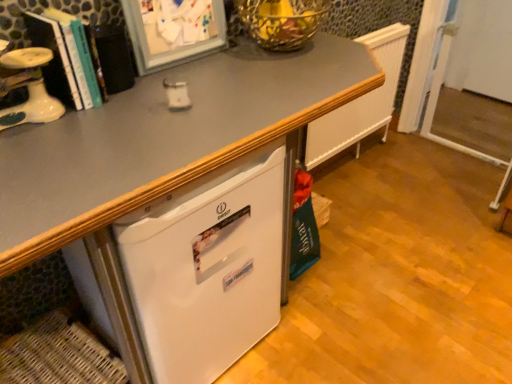
Question: From the image's perspective, is white glossy desk at center under hardcover book at left?

Choices:
 (A) yes
 (B) no

Answer: (A)

Question: Is white glossy desk at center smaller than hardcover book at left?

Choices:
 (A) yes
 (B) no

Answer: (B)

Question: From a real-world perspective, is white glossy desk at center located beneath hardcover book at left?

Choices:
 (A) no
 (B) yes

Answer: (B)

Question: Considering the relative sizes of white glossy desk at center and hardcover book at left in the image provided, is white glossy desk at center taller than hardcover book at left?

Choices:
 (A) no
 (B) yes

Answer: (B)

Question: Is white glossy desk at center further to the viewer compared to hardcover book at left?

Choices:
 (A) yes
 (B) no

Answer: (B)

Question: Does white glossy desk at center come in front of hardcover book at left?

Choices:
 (A) no
 (B) yes

Answer: (B)

Question: From a real-world perspective, is hardcover book at left on woven brown basket at lower left?

Choices:
 (A) no
 (B) yes

Answer: (B)

Question: Does hardcover book at left have a greater height compared to woven brown basket at lower left?

Choices:
 (A) yes
 (B) no

Answer: (A)

Question: Is hardcover book at left further to the viewer compared to woven brown basket at lower left?

Choices:
 (A) no
 (B) yes

Answer: (A)

Question: From a real-world perspective, is hardcover book at left beneath woven brown basket at lower left?

Choices:
 (A) yes
 (B) no

Answer: (B)

Question: Is hardcover book at left at the left side of woven brown basket at lower left?

Choices:
 (A) no
 (B) yes

Answer: (A)

Question: Does hardcover book at left contain woven brown basket at lower left?

Choices:
 (A) no
 (B) yes

Answer: (A)

Question: Is woven brown basket at lower left positioned with its back to white plastic screen door at right?

Choices:
 (A) yes
 (B) no

Answer: (B)